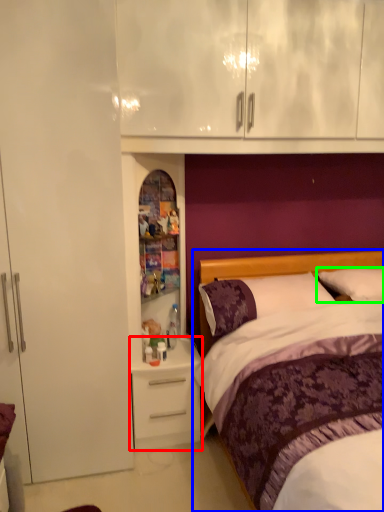
Question: Estimate the real-world distances between objects in this image. Which object is farther from desk (highlighted by a red box), bed (highlighted by a blue box) or pillow (highlighted by a green box)?

Choices:
 (A) bed
 (B) pillow

Answer: (B)